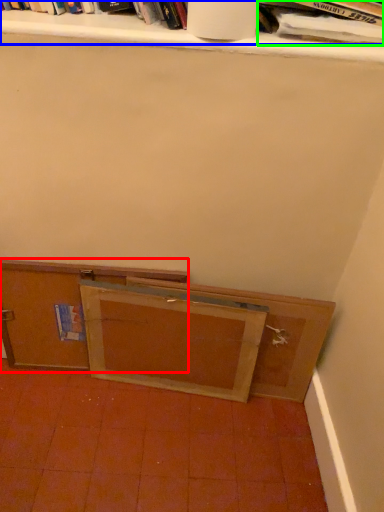
Question: Which is nearer to the cabinetry (highlighted by a red box)? book (highlighted by a blue box) or book (highlighted by a green box).

Choices:
 (A) book
 (B) book

Answer: (A)